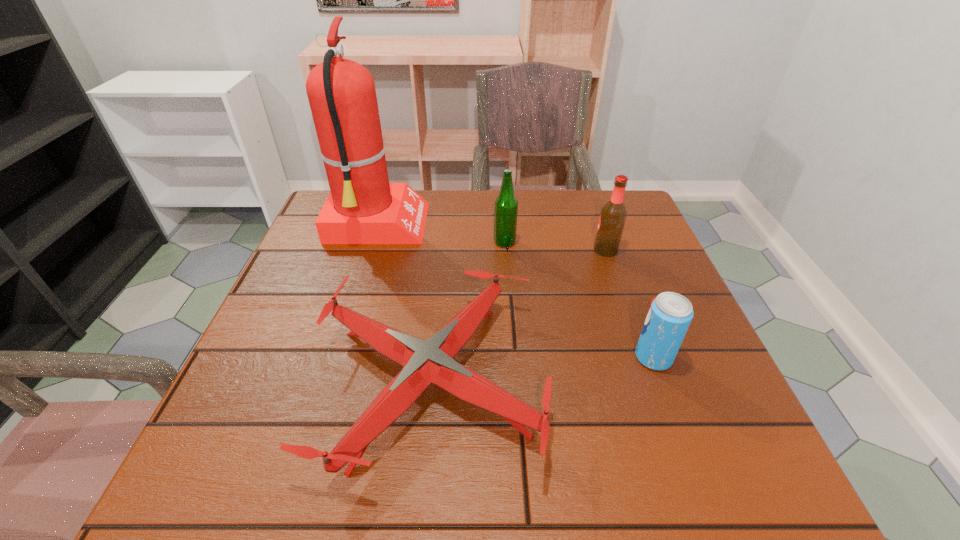
Identify the location of object that is at the near left corner. (424, 362).

The width and height of the screenshot is (960, 540). I want to click on vacant space at the far edge of the desktop, so click(x=552, y=207).

The width and height of the screenshot is (960, 540). In the image, there is a desktop. Find the location of `vacant space at the near edge`. vacant space at the near edge is located at coordinates (322, 466).

The image size is (960, 540). In the image, there is a desktop. In order to click on vacant space at the left edge in this screenshot , I will do `click(354, 283)`.

In the image, there is a desktop. Identify the location of free region at the right edge. The width and height of the screenshot is (960, 540). (703, 363).

Locate an element on the screen. This screenshot has height=540, width=960. vacant space at the near left corner of the desktop is located at coordinates (218, 443).

Locate an element on the screen. This screenshot has height=540, width=960. vacant space that is in between the tallest object and the right beer bottle is located at coordinates (492, 238).

This screenshot has height=540, width=960. I want to click on free point between the soda can and the drone, so click(542, 369).

Identify the location of free space between the tallest object and the right beer bottle. Image resolution: width=960 pixels, height=540 pixels. (492, 238).

Image resolution: width=960 pixels, height=540 pixels. What are the coordinates of `free spot between the tallest object and the left beer bottle` in the screenshot? It's located at (441, 234).